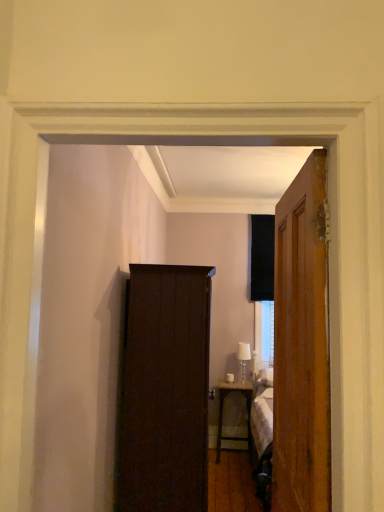
Question: Is point (183, 396) closer or farther from the camera than point (246, 378)?

Choices:
 (A) farther
 (B) closer

Answer: (B)

Question: Is dark wood cabinet at center situated inside clear glass lampshade at right or outside?

Choices:
 (A) inside
 (B) outside

Answer: (B)

Question: Considering the real-world distances, which object is farthest from the clear glass lampshade at right?

Choices:
 (A) metallic silver desk at center
 (B) dark wood cabinet at center
 (C) wooden door at right

Answer: (C)

Question: Which object is the closest to the dark wood cabinet at center?

Choices:
 (A) wooden door at right
 (B) metallic silver desk at center
 (C) clear glass lampshade at right

Answer: (A)